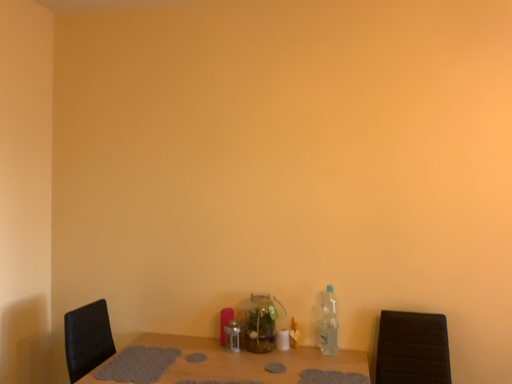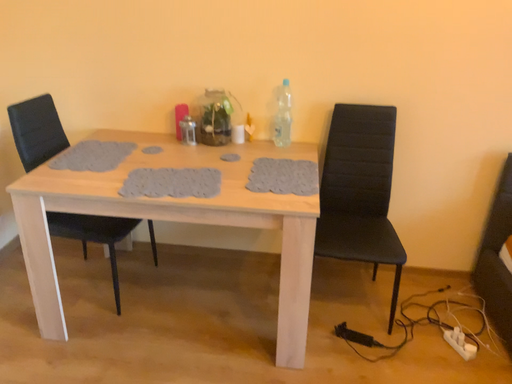
Question: Which way did the camera rotate in the video?

Choices:
 (A) rotated upward
 (B) rotated downward

Answer: (B)